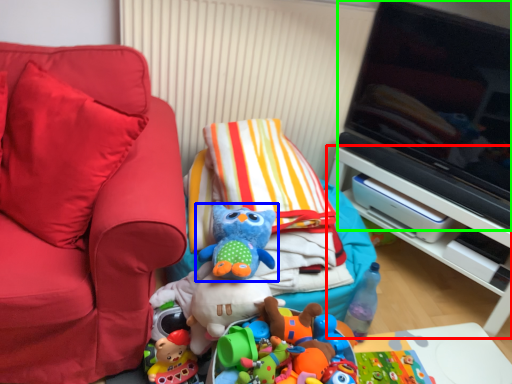
Question: Based on their relative distances, which object is farther from furniture (highlighted by a red box)? Choose from toy (highlighted by a blue box) and television (highlighted by a green box).

Choices:
 (A) toy
 (B) television

Answer: (A)